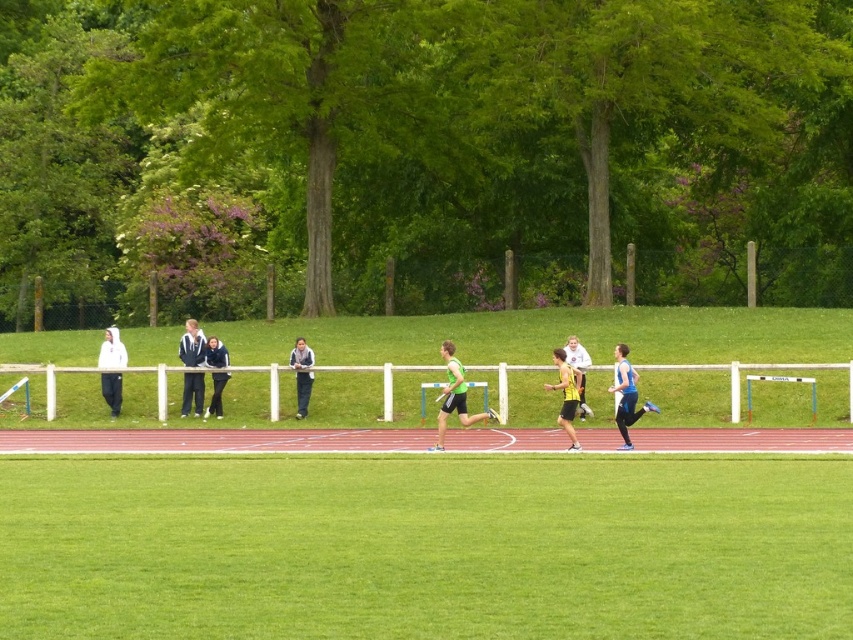
Measure the distance between blue fabric jacket at center and green matte hurdle at center.

blue fabric jacket at center and green matte hurdle at center are 19.21 feet apart.

Can you confirm if blue fabric jacket at center is positioned to the left of green matte hurdle at center?

Correct, you'll find blue fabric jacket at center to the left of green matte hurdle at center.

Does point (196, 401) come farther from viewer compared to point (422, 406)?

Yes, point (196, 401) is farther from viewer.

Identify the location of blue fabric jacket at center. The image size is (853, 640). (190, 344).

Consider the image. Is blue fabric jacket at center in front of light blue athletic top at center?

That is False.

Is blue fabric jacket at center wider than light blue athletic top at center?

Yes, blue fabric jacket at center is wider than light blue athletic top at center.

Between point (184, 339) and point (578, 387), which one is positioned behind?

Positioned behind is point (184, 339).

Identify the location of blue fabric jacket at center. This screenshot has height=640, width=853. (190, 344).

Is yellow-green athletic uniform at center below dark gray sweater at center?

No, yellow-green athletic uniform at center is not below dark gray sweater at center.

Is yellow-green athletic uniform at center bigger than dark gray sweater at center?

No.

This screenshot has height=640, width=853. Describe the element at coordinates (566, 396) in the screenshot. I see `yellow-green athletic uniform at center` at that location.

Where is `yellow-green athletic uniform at center`? yellow-green athletic uniform at center is located at coordinates (566, 396).